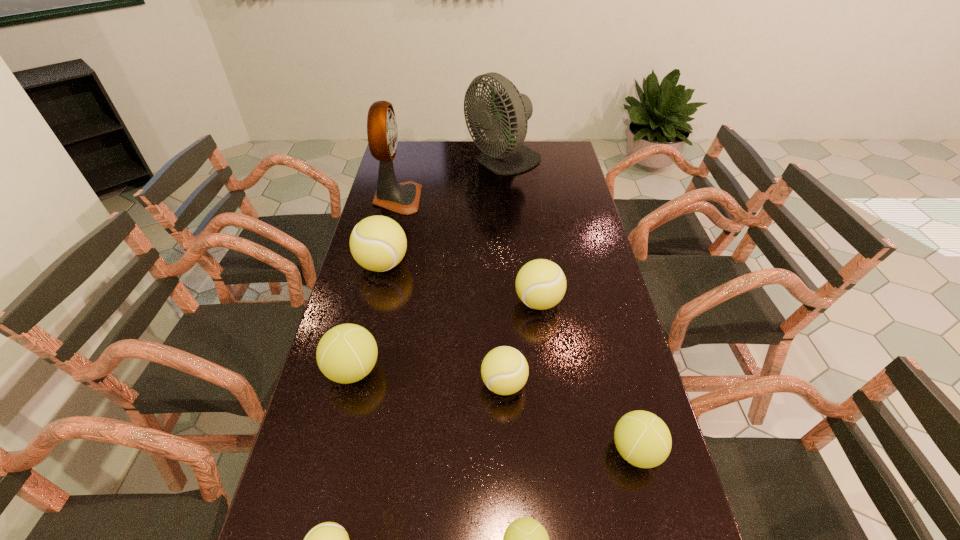
Find the location of `the rightmost object`. the rightmost object is located at coordinates coord(643,439).

Find the location of `free space located 0.160m in front of the right fan to direct airflow`. free space located 0.160m in front of the right fan to direct airflow is located at coordinates (428, 163).

Find the location of `vacant space located 0.150m in front of the right fan to direct airflow`. vacant space located 0.150m in front of the right fan to direct airflow is located at coordinates (431, 163).

Where is `vacant region located 0.100m in front of the right fan to direct airflow`? vacant region located 0.100m in front of the right fan to direct airflow is located at coordinates (442, 163).

Find the location of a particular element. The width and height of the screenshot is (960, 540). vacant space located on the front-facing side of the brown fan is located at coordinates (455, 199).

This screenshot has height=540, width=960. I want to click on vacant region located on the back of the biggest yellow tennis ball, so click(x=394, y=220).

Where is `vacant space located on the left of the sixth nearest object`? This screenshot has width=960, height=540. vacant space located on the left of the sixth nearest object is located at coordinates (417, 302).

This screenshot has width=960, height=540. Identify the location of vacant space located on the back of the farthest green tennis ball. [x=373, y=289].

Where is `vacant region located on the front of the third biggest yellow tennis ball`? Image resolution: width=960 pixels, height=540 pixels. vacant region located on the front of the third biggest yellow tennis ball is located at coordinates (511, 528).

Locate an element on the screen. free space located on the back of the third nearest tennis ball is located at coordinates (613, 364).